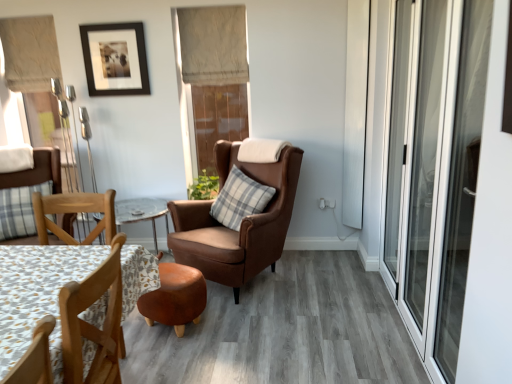
Question: Can you confirm if plaid fabric pillow at center is thinner than green leafy plant at center?

Choices:
 (A) no
 (B) yes

Answer: (A)

Question: Is plaid fabric pillow at center to the right of green leafy plant at center from the viewer's perspective?

Choices:
 (A) yes
 (B) no

Answer: (A)

Question: Considering the relative sizes of plaid fabric pillow at center and green leafy plant at center in the image provided, is plaid fabric pillow at center taller than green leafy plant at center?

Choices:
 (A) yes
 (B) no

Answer: (A)

Question: Does plaid fabric pillow at center have a larger size compared to green leafy plant at center?

Choices:
 (A) yes
 (B) no

Answer: (A)

Question: From a real-world perspective, does plaid fabric pillow at center stand above green leafy plant at center?

Choices:
 (A) no
 (B) yes

Answer: (B)

Question: Is plaid fabric pillow at center not near green leafy plant at center?

Choices:
 (A) no
 (B) yes

Answer: (A)

Question: Considering the relative positions of patterned fabric coffee table at lower left and brown leather wingback chair at center, the first chair positioned from the right, in the image provided, is patterned fabric coffee table at lower left behind brown leather wingback chair at center, the first chair positioned from the right,?

Choices:
 (A) yes
 (B) no

Answer: (B)

Question: Is patterned fabric coffee table at lower left surrounding brown leather wingback chair at center, the first chair positioned from the right?

Choices:
 (A) no
 (B) yes

Answer: (A)

Question: Is patterned fabric coffee table at lower left next to brown leather wingback chair at center, the 2th chair positioned from the left, and touching it?

Choices:
 (A) yes
 (B) no

Answer: (B)

Question: Could you tell me if patterned fabric coffee table at lower left is turned towards brown leather wingback chair at center, the 2th chair positioned from the left?

Choices:
 (A) no
 (B) yes

Answer: (A)

Question: Does patterned fabric coffee table at lower left appear on the right side of brown leather wingback chair at center, the first chair positioned from the right?

Choices:
 (A) no
 (B) yes

Answer: (A)

Question: Considering the relative positions of patterned fabric coffee table at lower left and brown leather wingback chair at center, the 2th chair positioned from the left, in the image provided, is patterned fabric coffee table at lower left to the left of brown leather wingback chair at center, the 2th chair positioned from the left, from the viewer's perspective?

Choices:
 (A) yes
 (B) no

Answer: (A)

Question: Is transparent glass screen door at right positioned far away from beige fabric curtain at upper left, acting as the 1th curtain starting from the left?

Choices:
 (A) yes
 (B) no

Answer: (A)